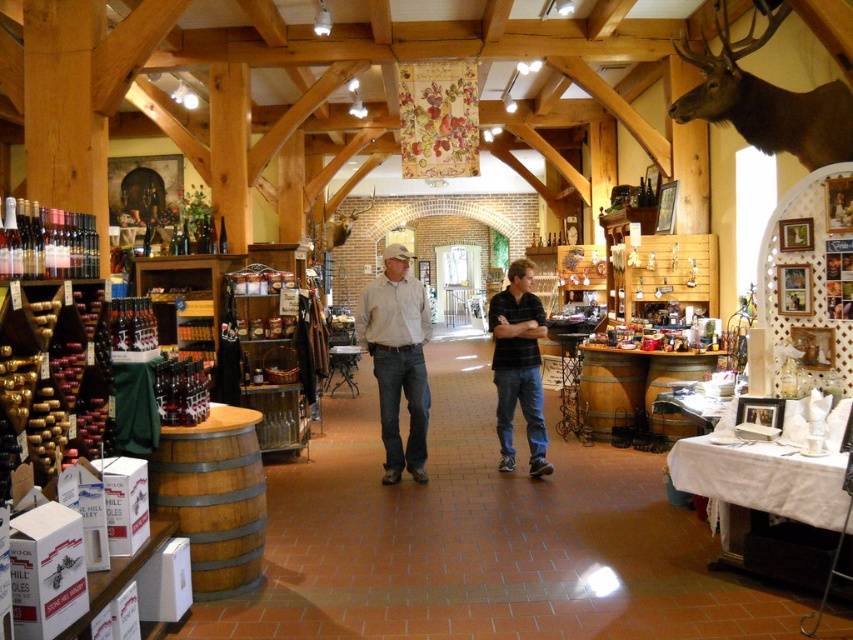
Is brown wooden barrel at lower left shorter than light brown jeans at center?

Indeed, brown wooden barrel at lower left has a lesser height compared to light brown jeans at center.

This screenshot has height=640, width=853. Find the location of `brown wooden barrel at lower left`. brown wooden barrel at lower left is located at coordinates (213, 497).

Where is `brown wooden barrel at lower left`? The width and height of the screenshot is (853, 640). brown wooden barrel at lower left is located at coordinates (213, 497).

Based on the photo, between light brown jeans at center and black cotton shirt at center, which one is positioned higher?

light brown jeans at center

Which is below, light brown jeans at center or black cotton shirt at center?

black cotton shirt at center

Is point (425, 296) positioned after point (506, 444)?

That is False.

This screenshot has width=853, height=640. I want to click on light brown jeans at center, so click(397, 358).

Which is in front, point (419, 474) or point (421, 346)?

Point (421, 346) is more forward.

Can you confirm if light brown jeans at center is bigger than light brown denim jeans at center?

Indeed, light brown jeans at center has a larger size compared to light brown denim jeans at center.

Image resolution: width=853 pixels, height=640 pixels. I want to click on light brown jeans at center, so click(x=397, y=358).

Find the location of a particular element. light brown jeans at center is located at coordinates (397, 358).